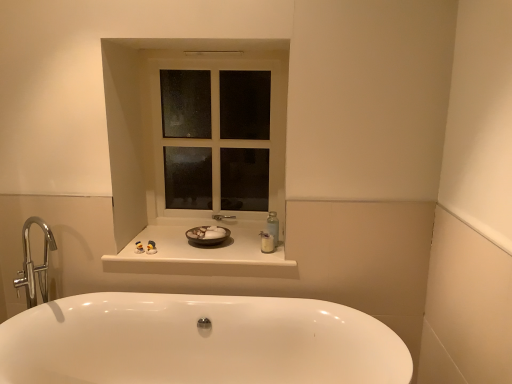
This screenshot has width=512, height=384. Find the location of `free space above white glass window at center (from a real-world perspective)`. free space above white glass window at center (from a real-world perspective) is located at coordinates (214, 53).